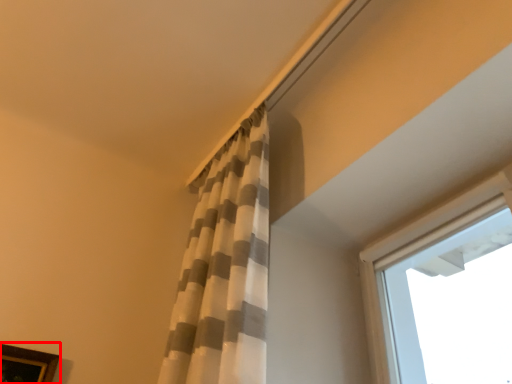
Question: From the image's perspective, where is picture frame (annotated by the red box) located relative to curtain?

Choices:
 (A) below
 (B) above

Answer: (A)